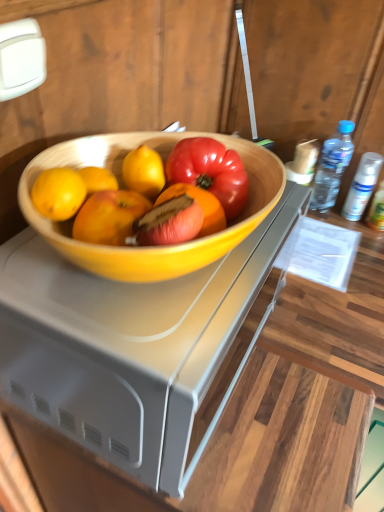
Where is `free space in front of white matte spray can at right, acting as the second bottle starting from the right`? This screenshot has width=384, height=512. free space in front of white matte spray can at right, acting as the second bottle starting from the right is located at coordinates (344, 249).